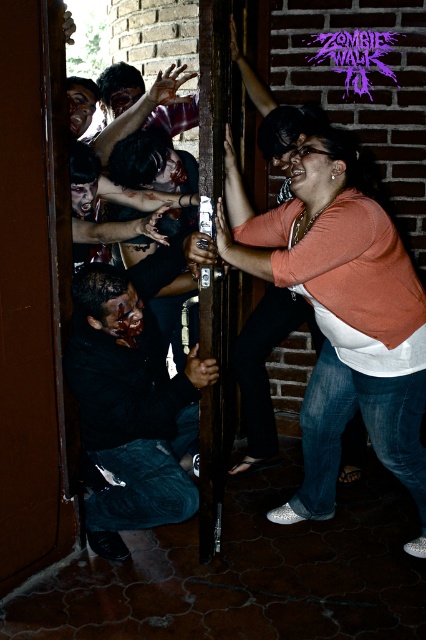
Question: Does orange matte shirt at upper right come in front of dark matte shirt at center?

Choices:
 (A) yes
 (B) no

Answer: (A)

Question: From the image, what is the correct spatial relationship of orange matte shirt at upper right in relation to dark matte shirt at center?

Choices:
 (A) below
 (B) above

Answer: (B)

Question: Which point is closer to the camera taking this photo?

Choices:
 (A) (x=412, y=456)
 (B) (x=215, y=378)

Answer: (B)

Question: Can you confirm if orange matte shirt at upper right is thinner than dark matte shirt at center?

Choices:
 (A) no
 (B) yes

Answer: (A)

Question: Which point is farther from the camera taking this photo?

Choices:
 (A) (416, 308)
 (B) (146, 458)

Answer: (B)

Question: Which point appears farthest from the camera in this image?

Choices:
 (A) (138, 433)
 (B) (327, 195)

Answer: (A)